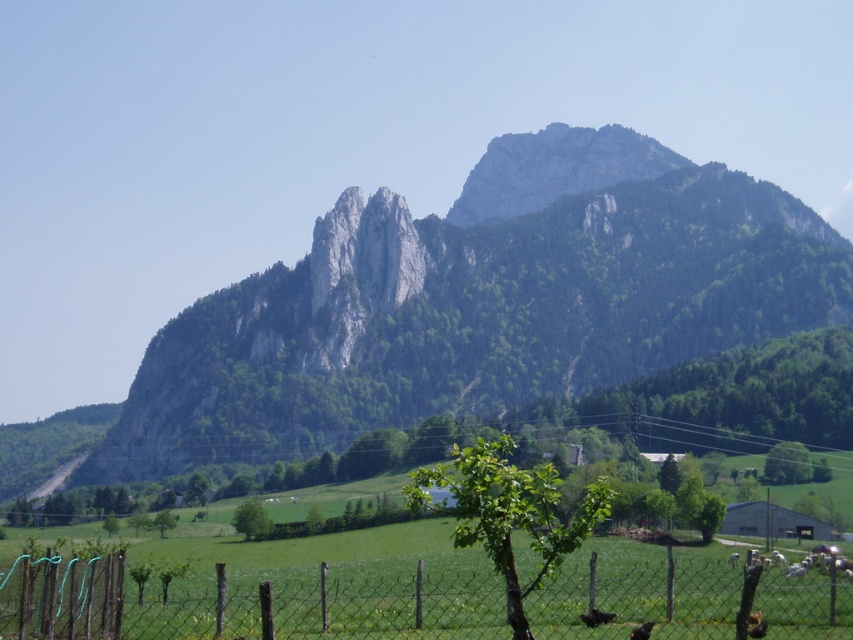
Looking at this image, is green rocky mountain at center further to the viewer compared to wire mesh fence at lower center?

That is True.

Is point (397, 285) farther from camera compared to point (387, 609)?

Yes.

I want to click on green rocky mountain at center, so click(x=461, y=308).